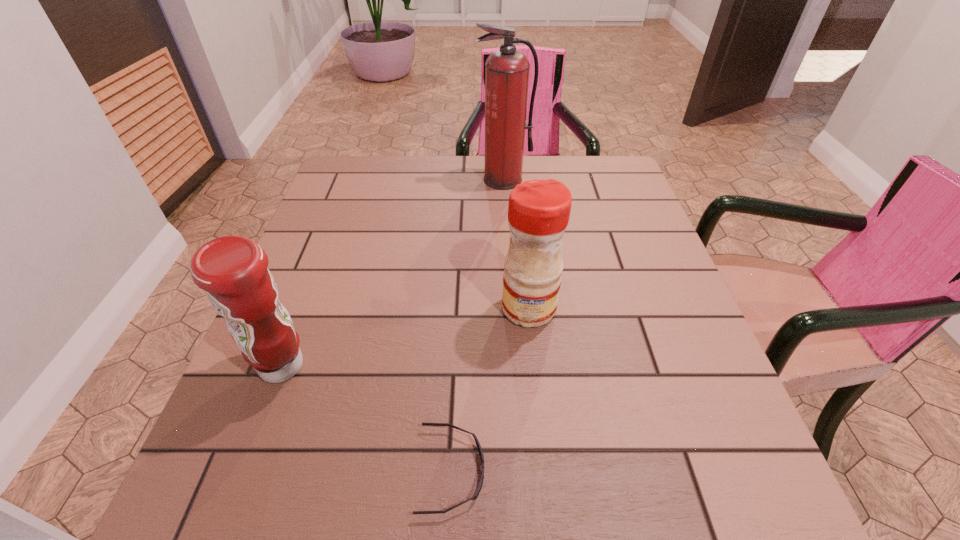
The image size is (960, 540). I want to click on vacant area at the far right corner of the desktop, so click(584, 174).

You are a GUI agent. You are given a task and a screenshot of the screen. Output one action in this format:
    pyautogui.click(x=<x>, y=<y>)
    Task: Click on the vacant area between the nearest object and the farther condiment
    
    Given the screenshot: What is the action you would take?
    click(491, 389)

The width and height of the screenshot is (960, 540). In order to click on vacant point located between the farther condiment and the left condiment in this screenshot , I will do `click(405, 338)`.

The height and width of the screenshot is (540, 960). What are the coordinates of `free space between the leftmost object and the nearest object` in the screenshot? It's located at (367, 418).

You are a GUI agent. You are given a task and a screenshot of the screen. Output one action in this format:
    pyautogui.click(x=<x>, y=<y>)
    Task: Click on the free area in between the second farthest object and the nearest object
    Image resolution: width=960 pixels, height=540 pixels.
    Given the screenshot: What is the action you would take?
    pyautogui.click(x=491, y=389)

This screenshot has width=960, height=540. I want to click on empty location between the shortest object and the farthest object, so click(x=478, y=325).

This screenshot has width=960, height=540. Identify the location of vacant area between the fire extinguisher and the nearest object. (478, 325).

At what (x,y) coordinates should I click in order to perform the action: click on free space between the farthest object and the sunglasses. Please return your answer as a coordinate pair (x, y). The image size is (960, 540). Looking at the image, I should click on (478, 325).

Where is `vacant area between the leftmost object and the nearest object`? The image size is (960, 540). vacant area between the leftmost object and the nearest object is located at coordinates (367, 418).

Where is `object that can be found as the second closest to the nearer condiment`? The width and height of the screenshot is (960, 540). object that can be found as the second closest to the nearer condiment is located at coordinates (539, 210).